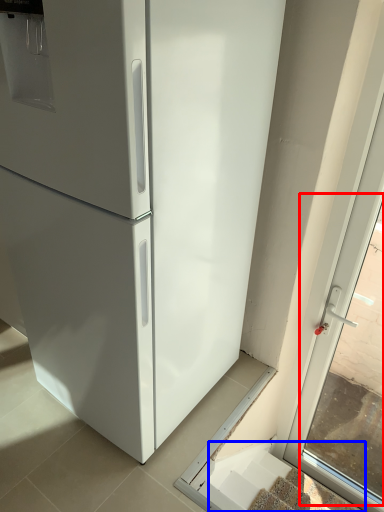
Question: Which object appears farthest to the camera in this image, window (highlighted by a red box) or stairs (highlighted by a blue box)?

Choices:
 (A) window
 (B) stairs

Answer: (B)